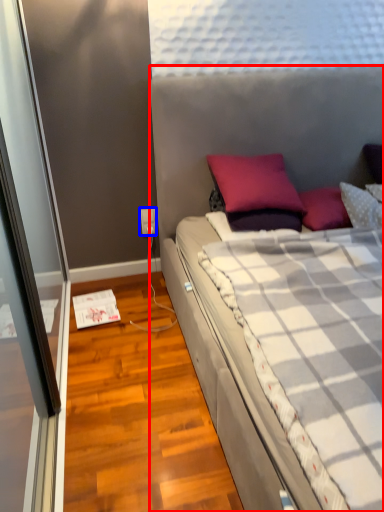
Question: Which object is further to the camera taking this photo, bed (highlighted by a red box) or power outlet (highlighted by a blue box)?

Choices:
 (A) bed
 (B) power outlet

Answer: (B)